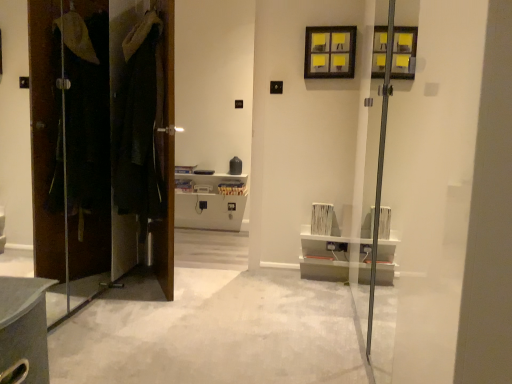
Question: Is the depth of brown wood door at left, placed as the 1th door when sorted from left to right, greater than that of dark brown leather coat at left, the first door in the right-to-left sequence?

Choices:
 (A) yes
 (B) no

Answer: (B)

Question: Can you see brown wood door at left, placed as the 1th door when sorted from left to right, touching dark brown leather coat at left, which appears as the second door when viewed from the left?

Choices:
 (A) yes
 (B) no

Answer: (A)

Question: Could you tell me if brown wood door at left, the 2th door positioned from the right, is turned towards dark brown leather coat at left, the first door in the right-to-left sequence?

Choices:
 (A) yes
 (B) no

Answer: (A)

Question: From a real-world perspective, is brown wood door at left, placed as the 1th door when sorted from left to right, beneath dark brown leather coat at left, the first door in the right-to-left sequence?

Choices:
 (A) yes
 (B) no

Answer: (A)

Question: Is brown wood door at left, the 2th door positioned from the right, at the left side of dark brown leather coat at left, which appears as the second door when viewed from the left?

Choices:
 (A) yes
 (B) no

Answer: (A)

Question: Is white carpet at center situated inside yellow paper at upper center or outside?

Choices:
 (A) inside
 (B) outside

Answer: (B)

Question: In the image, is white carpet at center on the left side or the right side of yellow paper at upper center?

Choices:
 (A) right
 (B) left

Answer: (B)

Question: Is point (256, 294) closer or farther from the camera than point (322, 41)?

Choices:
 (A) farther
 (B) closer

Answer: (B)

Question: In the image, is white carpet at center positioned in front of or behind yellow paper at upper center?

Choices:
 (A) behind
 (B) front

Answer: (B)

Question: In the image, is dark brown leather coat at left, the first door in the right-to-left sequence, on the left side or the right side of yellow paper at upper center?

Choices:
 (A) right
 (B) left

Answer: (B)

Question: Relative to yellow paper at upper center, is dark brown leather coat at left, which appears as the second door when viewed from the left, in front or behind?

Choices:
 (A) behind
 (B) front

Answer: (B)

Question: Do you think dark brown leather coat at left, which appears as the second door when viewed from the left, is within yellow paper at upper center, or outside of it?

Choices:
 (A) outside
 (B) inside

Answer: (A)

Question: From the image's perspective, is dark brown leather coat at left, the first door in the right-to-left sequence, positioned above or below yellow paper at upper center?

Choices:
 (A) above
 (B) below

Answer: (B)

Question: From the image's perspective, is yellow paper at upper center above or below dark brown leather coat at left, the first door in the right-to-left sequence?

Choices:
 (A) below
 (B) above

Answer: (B)

Question: From a real-world perspective, is yellow paper at upper center above or below dark brown leather coat at left, the first door in the right-to-left sequence?

Choices:
 (A) above
 (B) below

Answer: (A)